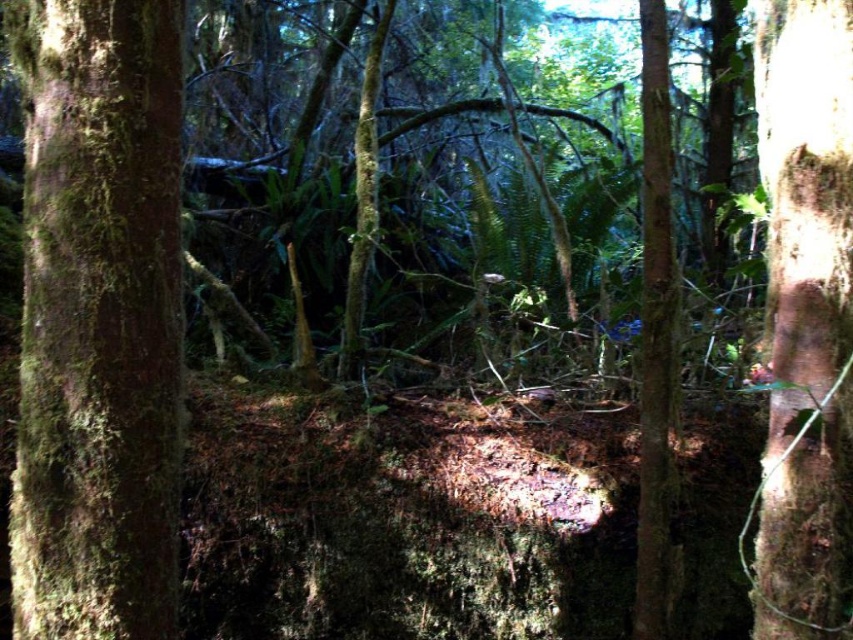
Based on the scene description, where is the green mossy tree trunk at left located in the image?

The green mossy tree trunk at left is located at the 2D coordinates point (97, 321) in the image.

You are standing in the forest scene described. You notice a point marked at coordinates (804, 308). Which object does this point indicate?

The point marks the brown rough bark tree trunk at right.

You are an environmental scientist studying tree growth in this forest. You notice the brown rough bark tree trunk at right and the smooth bark tree trunk at center. Which tree trunk is shorter in height?

The brown rough bark tree trunk at right has a lesser height compared to the smooth bark tree trunk at center, so the brown rough bark tree trunk at right is shorter in height.